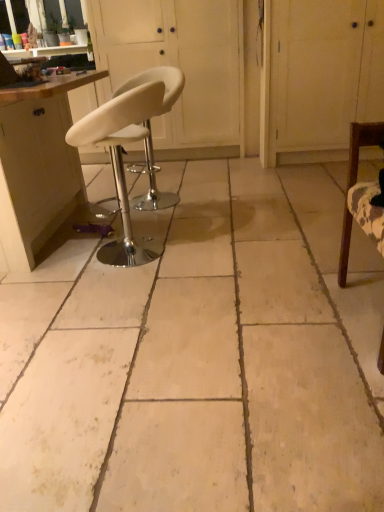
Question: Is white leather stool at center, the first screen door from the left, thinner than white leather stool at center, the 3th chair positioned from the right?

Choices:
 (A) yes
 (B) no

Answer: (B)

Question: Considering the relative sizes of white leather stool at center, the first screen door from the left, and white leather stool at center, the 2th chair when ordered from front to back, in the image provided, is white leather stool at center, the first screen door from the left, smaller than white leather stool at center, the 2th chair when ordered from front to back,?

Choices:
 (A) no
 (B) yes

Answer: (A)

Question: Considering the relative sizes of white leather stool at center, placed as the second screen door when sorted from right to left, and white leather stool at center, arranged as the 2th chair when viewed from the back, in the image provided, is white leather stool at center, placed as the second screen door when sorted from right to left, wider than white leather stool at center, arranged as the 2th chair when viewed from the back,?

Choices:
 (A) yes
 (B) no

Answer: (A)

Question: Is white leather stool at center, the first screen door from the left, oriented towards white leather stool at center, the 2th chair when ordered from front to back?

Choices:
 (A) no
 (B) yes

Answer: (B)

Question: From the image's perspective, does white leather stool at center, the first screen door from the left, appear lower than white leather stool at center, acting as the 1th chair starting from the left?

Choices:
 (A) yes
 (B) no

Answer: (B)

Question: Is white leather stool at center, the first screen door from the left, turned away from white leather stool at center, acting as the 1th chair starting from the left?

Choices:
 (A) yes
 (B) no

Answer: (B)

Question: Can you confirm if white leather stool at center, the 2th chair when ordered from front to back, is positioned to the right of wooden chair at right, the third chair positioned from the left?

Choices:
 (A) yes
 (B) no

Answer: (B)

Question: Is white leather stool at center, the 2th chair when ordered from front to back, touching wooden chair at right, the first chair when ordered from front to back?

Choices:
 (A) no
 (B) yes

Answer: (A)

Question: Can you confirm if white leather stool at center, the 3th chair positioned from the right, is positioned to the left of wooden chair at right, arranged as the 1th chair when viewed from the right?

Choices:
 (A) no
 (B) yes

Answer: (B)

Question: Does white leather stool at center, arranged as the 2th chair when viewed from the back, lie in front of wooden chair at right, the first chair when ordered from front to back?

Choices:
 (A) no
 (B) yes

Answer: (A)

Question: From the image's perspective, would you say white leather stool at center, the 2th chair when ordered from front to back, is positioned over wooden chair at right, the first chair when ordered from front to back?

Choices:
 (A) no
 (B) yes

Answer: (B)

Question: Is white leather stool at center, arranged as the 2th chair when viewed from the back, wider than wooden chair at right, the third chair positioned from the left?

Choices:
 (A) no
 (B) yes

Answer: (B)

Question: Are matte wood cabinet at left and white leather stool at center, the 3th chair positioned from the right, located far from each other?

Choices:
 (A) yes
 (B) no

Answer: (B)